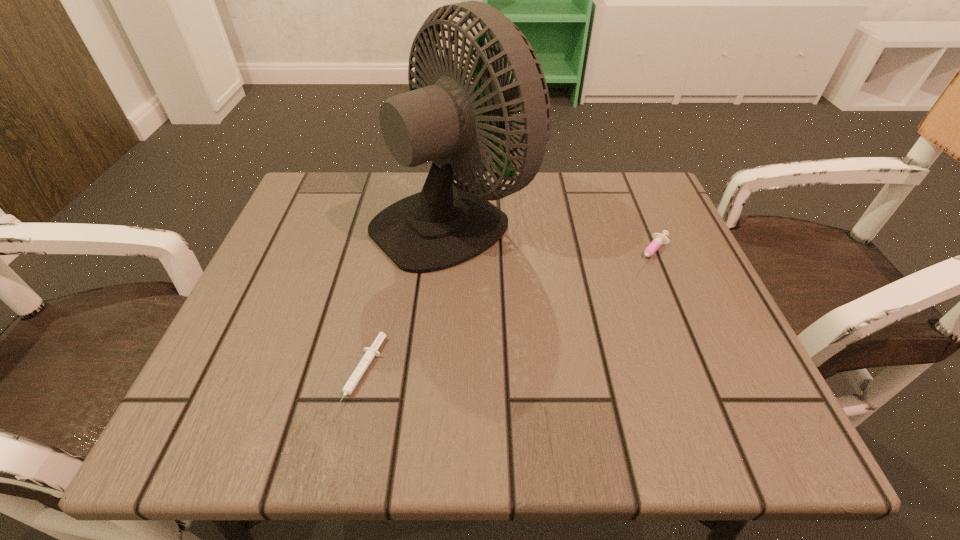
I want to click on the tallest object, so click(447, 223).

In order to click on the farther syringe in this screenshot , I will do `click(658, 239)`.

Locate an element on the screen. the second tallest object is located at coordinates (658, 239).

Image resolution: width=960 pixels, height=540 pixels. I want to click on the shortest object, so click(x=371, y=352).

Identify the location of the shorter syringe. This screenshot has height=540, width=960. (371, 352).

Locate an element on the screen. This screenshot has width=960, height=540. free space located in front of the fan to direct airflow is located at coordinates (571, 217).

Identify the location of free space located on the front of the right syringe. The image size is (960, 540). (669, 299).

At what (x,y) coordinates should I click in order to perform the action: click on free space located on the back of the nearer syringe. Please return your answer as a coordinate pair (x, y). This screenshot has height=540, width=960. Looking at the image, I should click on (389, 254).

This screenshot has height=540, width=960. Find the location of `object that is positioned at the far edge`. object that is positioned at the far edge is located at coordinates (447, 223).

In order to click on object located in the near edge section of the desktop in this screenshot , I will do `click(371, 352)`.